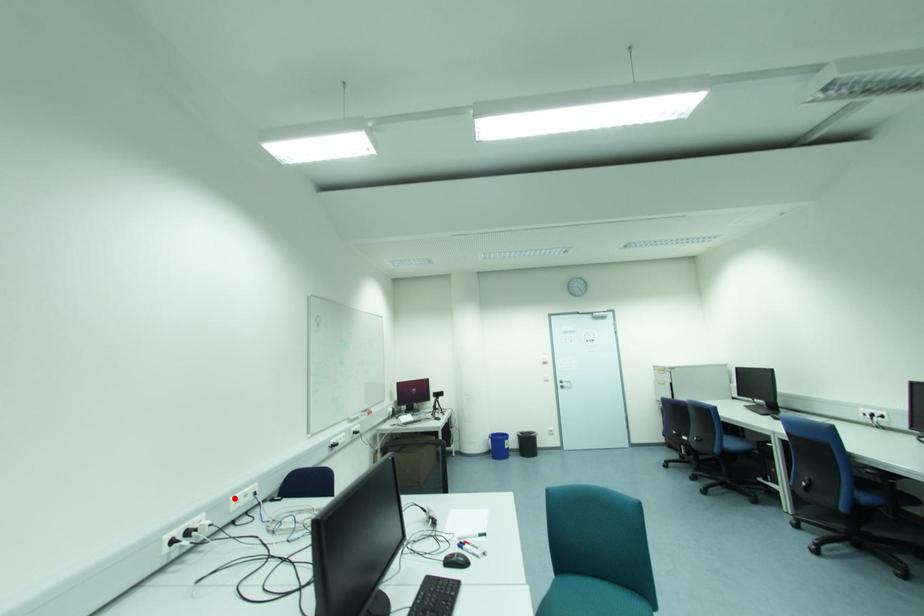
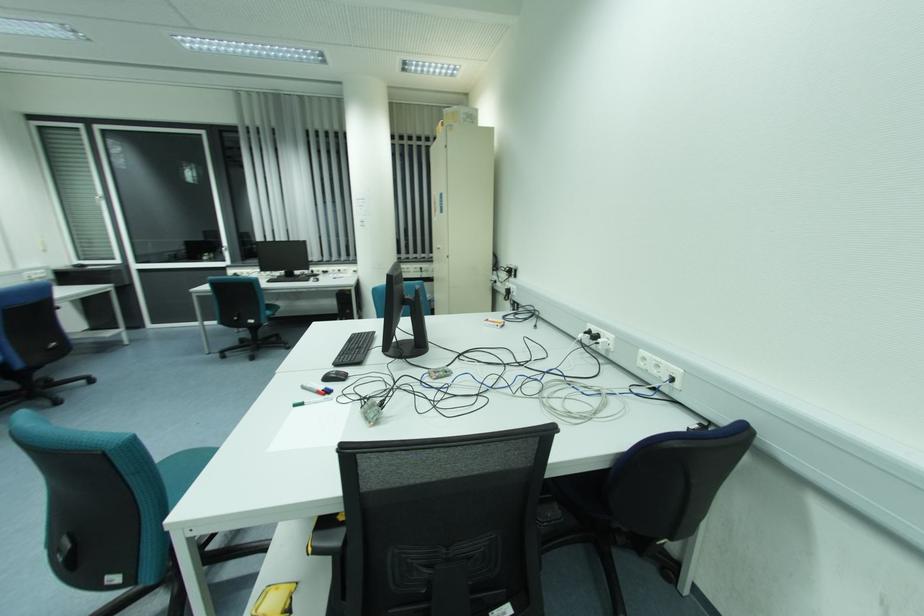
Find the pixel in the second image that matches the highlighted location in the first image.

(642, 352)